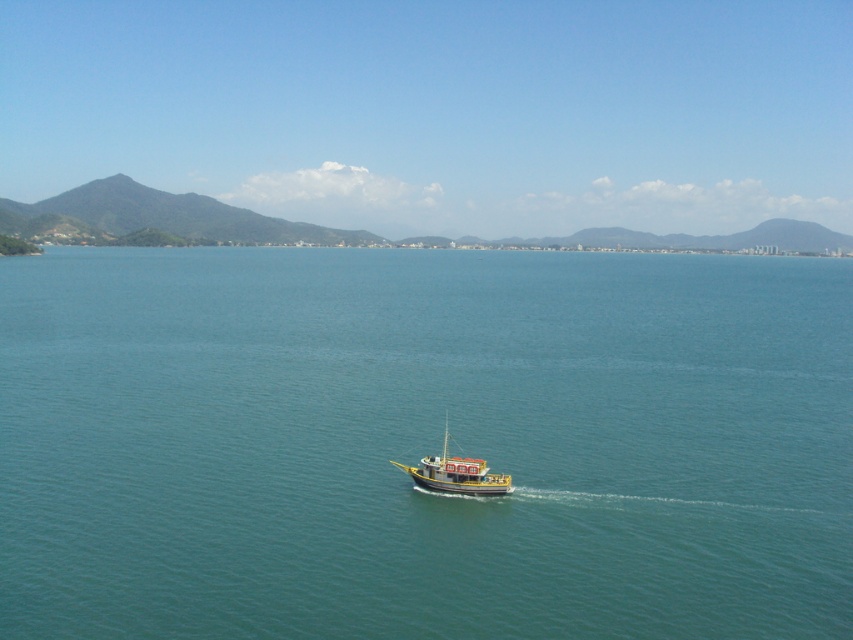
Does teal smooth water at center appear on the left side of wooden boat at center?

In fact, teal smooth water at center is to the right of wooden boat at center.

You are a GUI agent. You are given a task and a screenshot of the screen. Output one action in this format:
    pyautogui.click(x=<x>, y=<y>)
    Task: Click on the teal smooth water at center
    The width and height of the screenshot is (853, 640).
    Given the screenshot: What is the action you would take?
    pyautogui.click(x=422, y=444)